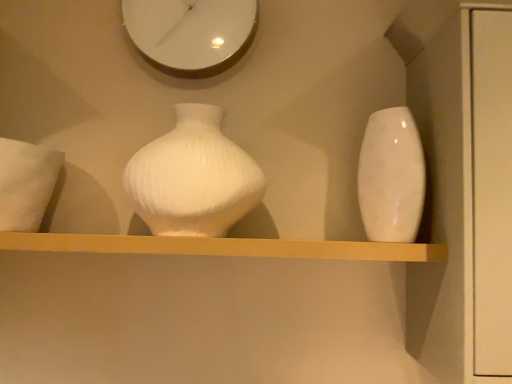
Question: From the image's perspective, is white ribbed vase at center, which is the 1th vase in left-to-right order, above matte white shelf at center?

Choices:
 (A) yes
 (B) no

Answer: (A)

Question: Is white ribbed vase at center, which is the 1th vase in left-to-right order, wider than matte white shelf at center?

Choices:
 (A) yes
 (B) no

Answer: (B)

Question: Is white ribbed vase at center, placed as the second vase when sorted from right to left, far from matte white shelf at center?

Choices:
 (A) yes
 (B) no

Answer: (B)

Question: Is white ribbed vase at center, placed as the second vase when sorted from right to left, shorter than matte white shelf at center?

Choices:
 (A) yes
 (B) no

Answer: (B)

Question: Can you confirm if white ribbed vase at center, placed as the second vase when sorted from right to left, is bigger than matte white shelf at center?

Choices:
 (A) no
 (B) yes

Answer: (B)

Question: Are white ribbed vase at center, which is the 1th vase in left-to-right order, and matte white shelf at center making contact?

Choices:
 (A) no
 (B) yes

Answer: (A)

Question: From the image's perspective, is white soft pillow at left located beneath white ribbed vase at center, placed as the second vase when sorted from right to left?

Choices:
 (A) yes
 (B) no

Answer: (A)

Question: Is white soft pillow at left outside white ribbed vase at center, which is the 1th vase in left-to-right order?

Choices:
 (A) yes
 (B) no

Answer: (A)

Question: Considering the relative positions of white soft pillow at left and white ribbed vase at center, which is the 1th vase in left-to-right order, in the image provided, is white soft pillow at left to the left of white ribbed vase at center, which is the 1th vase in left-to-right order, from the viewer's perspective?

Choices:
 (A) yes
 (B) no

Answer: (A)

Question: Could white ribbed vase at center, which is the 1th vase in left-to-right order, be considered to be inside white soft pillow at left?

Choices:
 (A) no
 (B) yes

Answer: (A)

Question: Is white soft pillow at left to the right of white ribbed vase at center, placed as the second vase when sorted from right to left, from the viewer's perspective?

Choices:
 (A) yes
 (B) no

Answer: (B)

Question: Does white soft pillow at left turn towards white ribbed vase at center, placed as the second vase when sorted from right to left?

Choices:
 (A) no
 (B) yes

Answer: (A)

Question: From a real-world perspective, is white soft pillow at left below glossy ceramic vase at right, placed as the first vase when sorted from right to left?

Choices:
 (A) no
 (B) yes

Answer: (B)